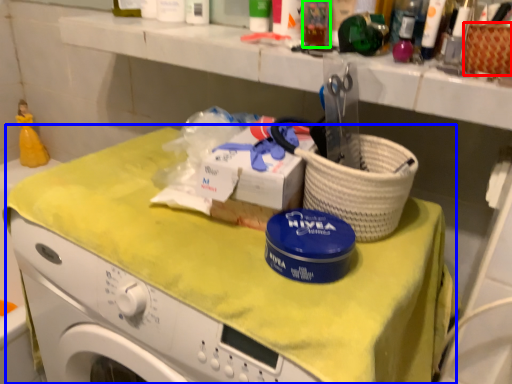
Question: Which object is positioned closest to basket (highlighted by a red box)? Select from counter (highlighted by a blue box) and toiletry (highlighted by a green box).

Choices:
 (A) counter
 (B) toiletry

Answer: (B)